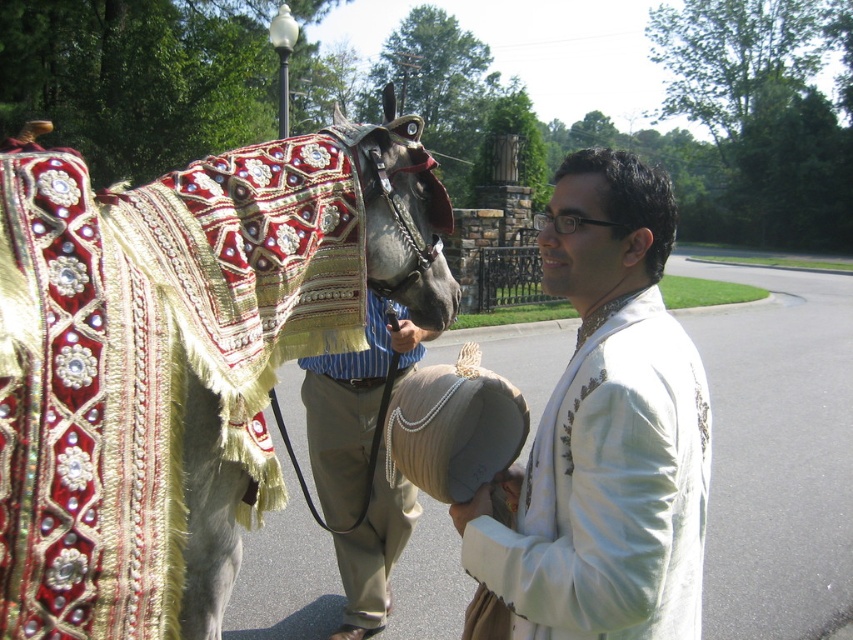
Is shiny gold blanket at left below striped fabric pants at center?

No, shiny gold blanket at left is not below striped fabric pants at center.

Can you confirm if shiny gold blanket at left is positioned above striped fabric pants at center?

Correct, shiny gold blanket at left is located above striped fabric pants at center.

Which is in front, point (39, 180) or point (308, 435)?

Point (39, 180) is more forward.

I want to click on shiny gold blanket at left, so click(180, 356).

Based on the photo, between shiny gold blanket at left and white embroidered shirt at center, which one appears on the right side from the viewer's perspective?

white embroidered shirt at center is more to the right.

Does shiny gold blanket at left appear on the left side of white embroidered shirt at center?

Correct, you'll find shiny gold blanket at left to the left of white embroidered shirt at center.

Identify the location of shiny gold blanket at left. coord(180,356).

How far apart are white embroidered shirt at center and striped fabric pants at center?

white embroidered shirt at center is 5.83 feet from striped fabric pants at center.

Is point (648, 596) positioned in front of point (334, 380)?

Yes, point (648, 596) is in front of point (334, 380).

Which is behind, point (619, 269) or point (399, 348)?

Point (399, 348)

Locate an element on the screen. white embroidered shirt at center is located at coordinates (606, 432).